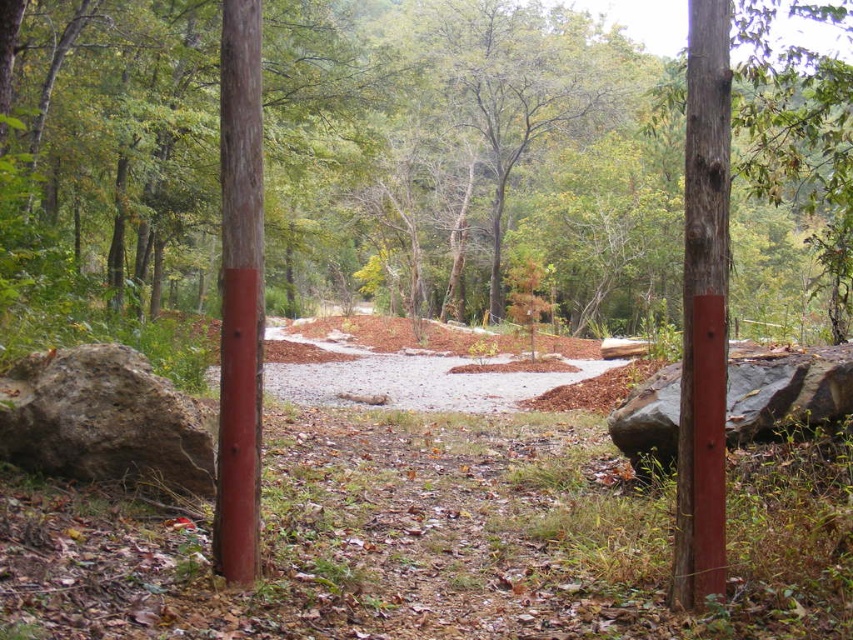
You are a hiker who wants to take a photo of both the smooth bark tree at center and the wooden post at center. Which object should you focus on first if you want to capture both in the same frame without moving your camera?

The smooth bark tree at center is taller than the wooden post at center, so you should focus on the smooth bark tree at center first to ensure it fits within the frame.

You are standing in a forest clearing and see a smooth wood post at center. You need to place a 15 feet long rope from your current position to the post. Will the rope be long enough to reach the post?

The smooth wood post at center is 14.90 feet from viewer. The rope is 15 feet long, so it will be long enough to reach the post with a little extra length remaining.